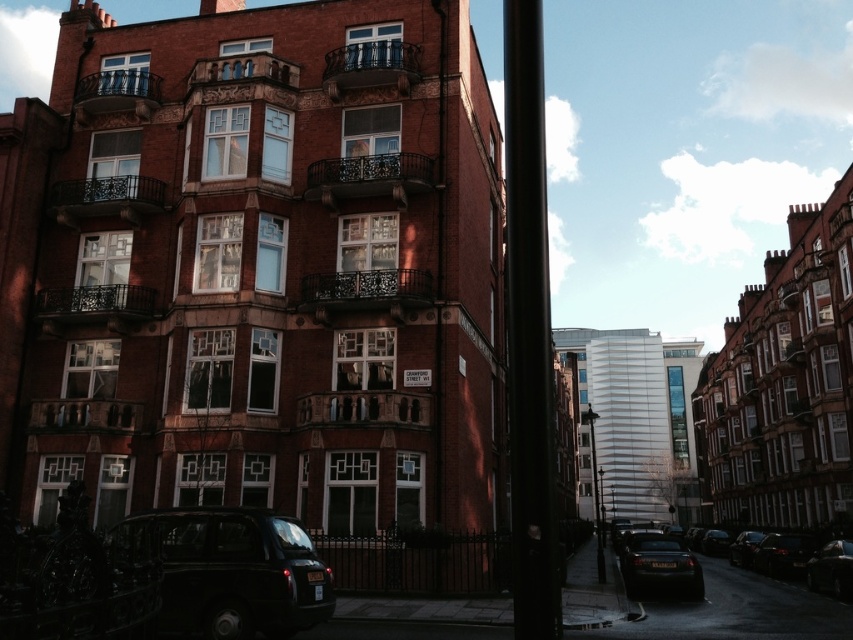
What do you see at coordinates (231, 572) in the screenshot?
I see `black matte taxi at lower left` at bounding box center [231, 572].

Does black matte taxi at lower left appear on the right side of shiny black sedan at center?

Incorrect, black matte taxi at lower left is not on the right side of shiny black sedan at center.

Who is more forward, [321,561] or [636,561]?

Positioned in front is point [321,561].

Where is `black matte taxi at lower left`? black matte taxi at lower left is located at coordinates (231, 572).

Does point (527, 604) come farther from viewer compared to point (688, 556)?

No, (527, 604) is in front of (688, 556).

Can you confirm if black matte pole at center is wider than shiny black sedan at center?

No.

Image resolution: width=853 pixels, height=640 pixels. I want to click on black matte pole at center, so click(529, 330).

The height and width of the screenshot is (640, 853). Find the location of `black matte pole at center`. black matte pole at center is located at coordinates (529, 330).

Who is more forward, (x=527, y=84) or (x=585, y=419)?

Point (x=527, y=84) is more forward.

Is point (558, 572) positioned in front of point (593, 448)?

Yes, it is in front of point (593, 448).

Locate an element on the screen. Image resolution: width=853 pixels, height=640 pixels. black matte pole at center is located at coordinates (529, 330).